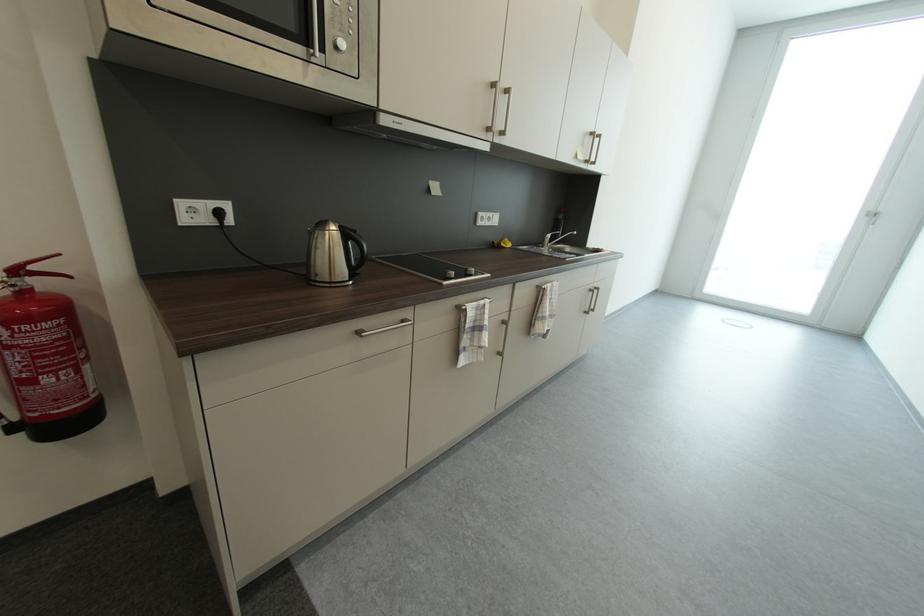
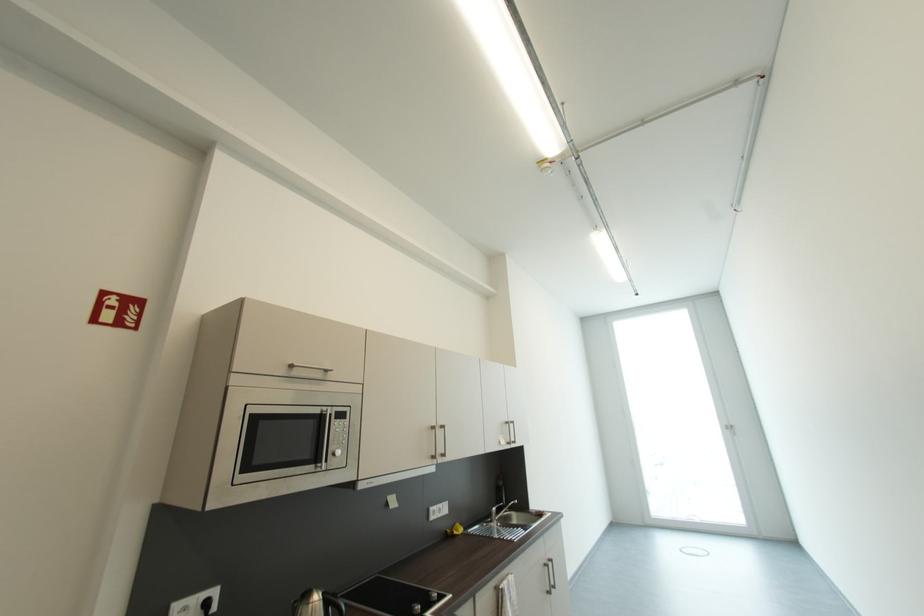
In the second image, find the point that corresponds to [548,246] in the first image.

(495, 522)